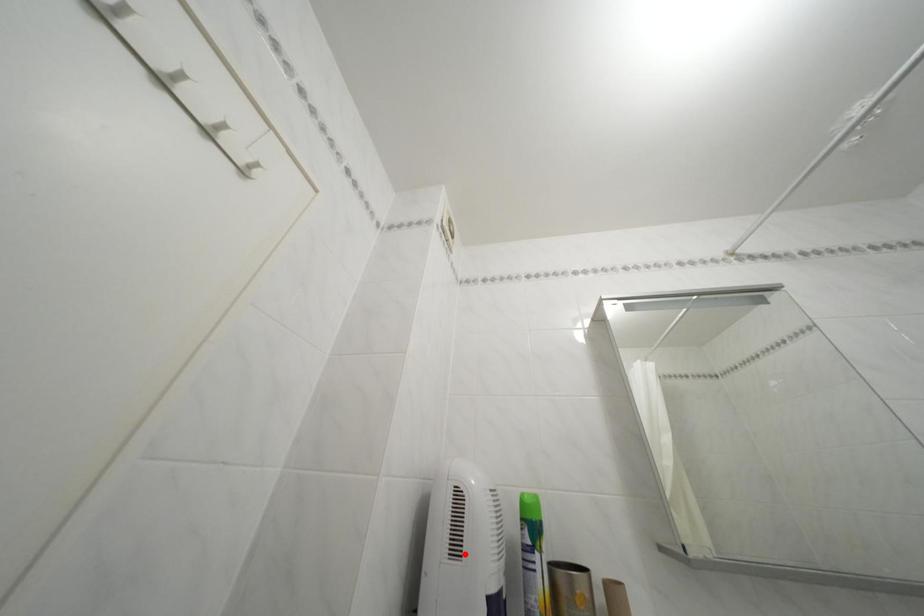
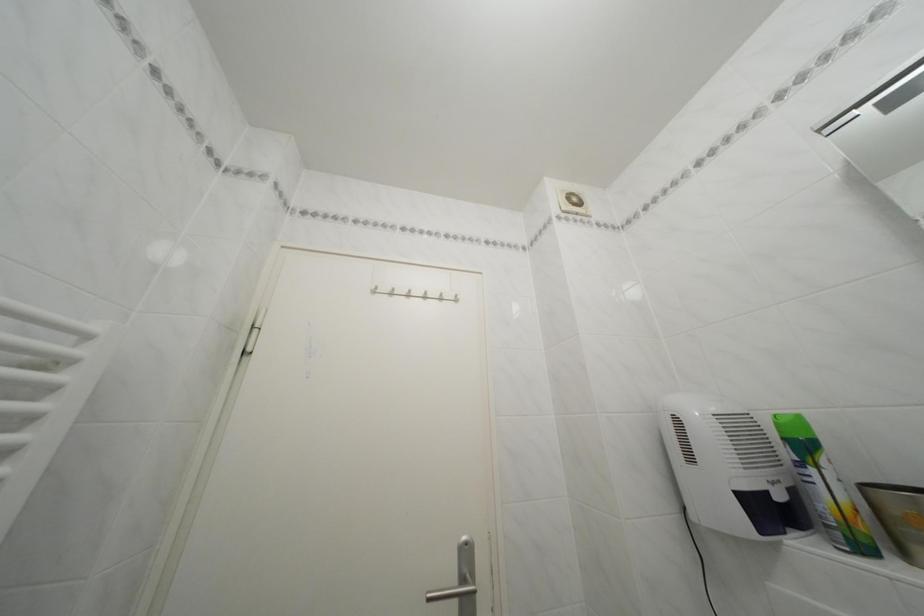
The point at the highlighted location is marked in the first image. Where is the corresponding point in the second image?

(699, 464)